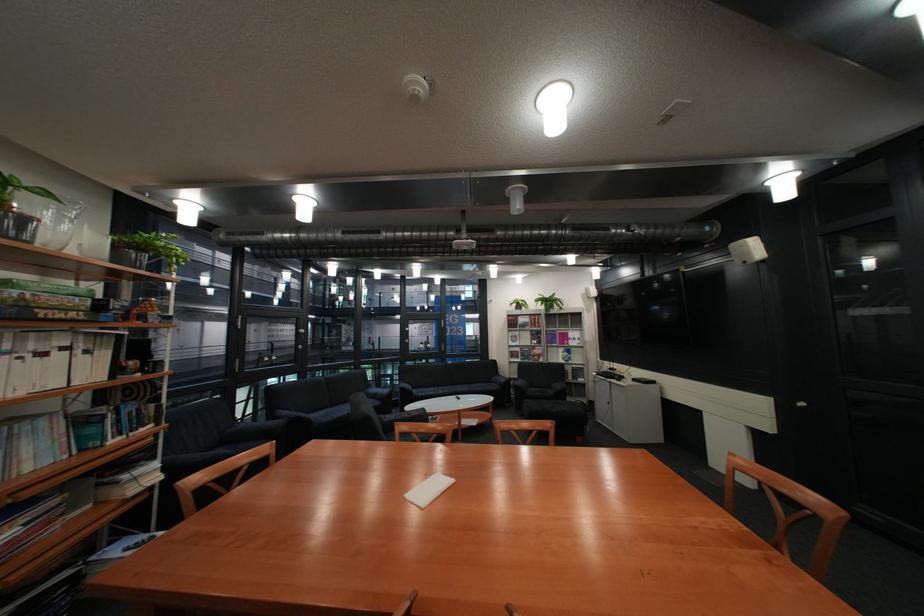
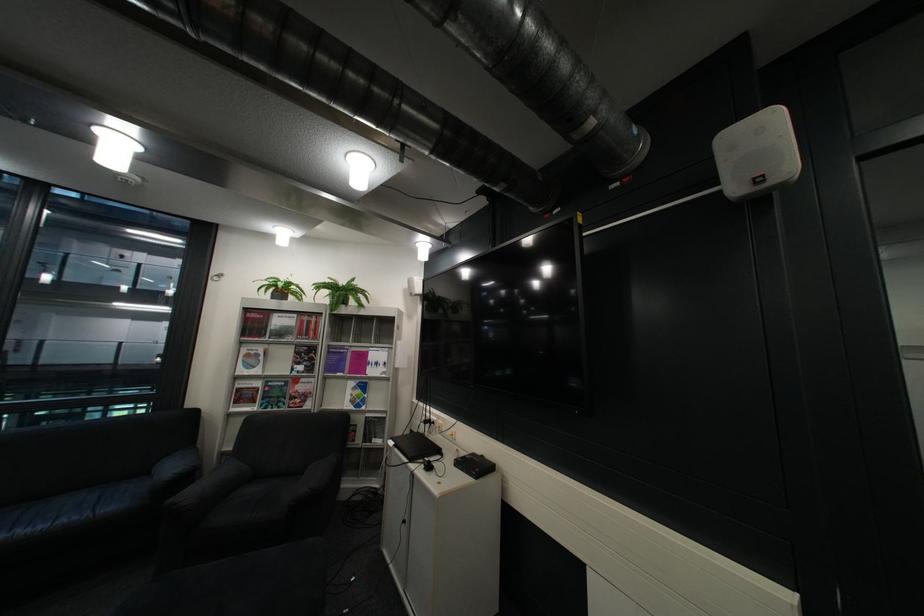
Locate, in the second image, the point that corresponds to (x=596, y=379) in the first image.

(393, 442)